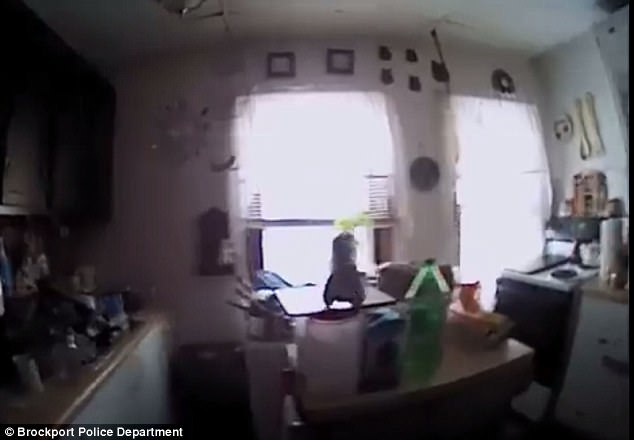
Find the location of a particular element. This screenshot has height=440, width=634. windows is located at coordinates (324, 172), (513, 163).